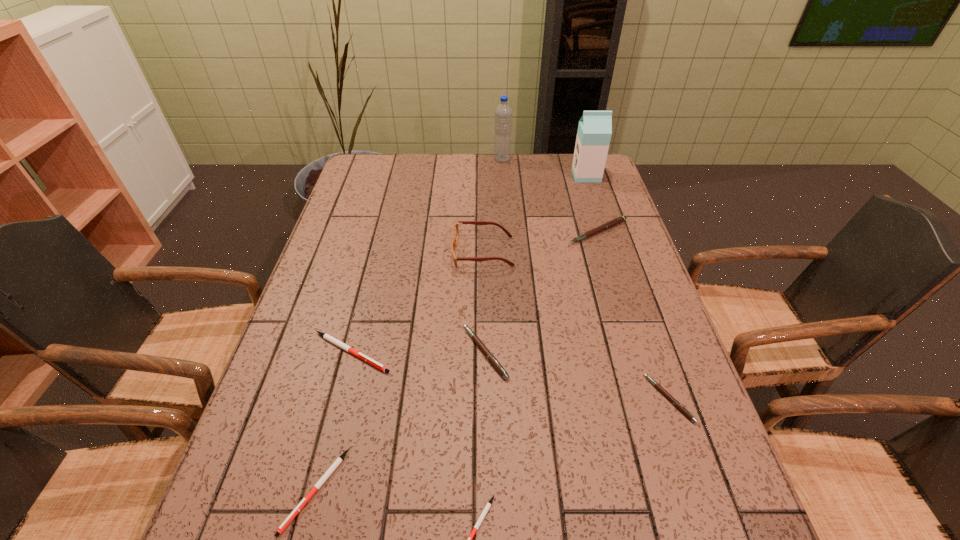
You are a GUI agent. You are given a task and a screenshot of the screen. Output one action in this format:
    pyautogui.click(x=<x>, y=<y>)
    Task: Click on the white pen that is the second closest to the second biggest white pen
    
    Given the screenshot: What is the action you would take?
    488,505

What are the coordinates of `vacant space that satisfies the following two spatial constraints: 1. on the clicker of the farthest white pen; 2. on the clicker of the second biggest white pen` in the screenshot? It's located at (316, 490).

Locate an element on the screen. This screenshot has height=540, width=960. free space that satisfies the following two spatial constraints: 1. on the front side of the white milk carton; 2. on the right side of the water bottle is located at coordinates (503, 176).

The height and width of the screenshot is (540, 960). In order to click on free space that satisfies the following two spatial constraints: 1. at the nib of the farthest pink pen; 2. at the nib of the leftmost pink pen in this screenshot , I will do pos(636,353).